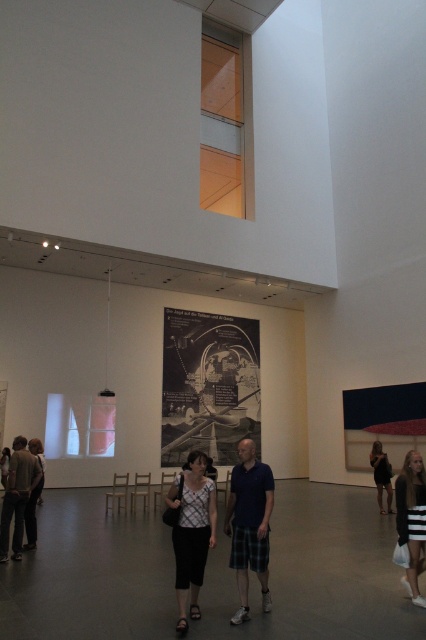
You are an art curator standing in the gallery and need to adjust the placement of the matte blue shirt at center and the white printed blouse at center. Which one is currently on the right side?

The matte blue shirt at center is positioned on the right side of the white printed blouse at center.

You are an art curator preparing an exhibition. You need to hang a new painting that requires a wall space not occupied by the white printed blouse at center or the striped cotton dress at lower right. Based on their current positions, which area of the wall would be suitable for the new painting?

The new painting should be placed in an area of the wall that is neither where the white printed blouse at center is positioned nor behind it, since the white printed blouse at center is in front of the striped cotton dress at lower right, indicating overlapping or layered placement. Suitable areas could be above, below, to the sides, or behind the striped cotton dress at lower right, ensuring no overlap with either object.